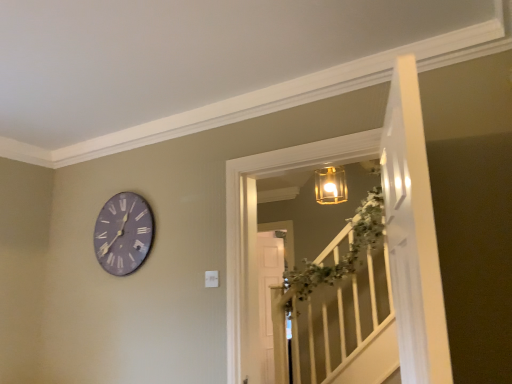
Question: Is translucent glass lantern at upper center taller or shorter than white glossy door at upper right?

Choices:
 (A) short
 (B) tall

Answer: (A)

Question: Is translucent glass lantern at upper center in front of or behind white glossy door at upper right in the image?

Choices:
 (A) front
 (B) behind

Answer: (B)

Question: Estimate the real-world distances between objects in this image. Which object is farther from the translucent glass lantern at upper center?

Choices:
 (A) white glossy door at upper right
 (B) purple matte clock at upper left

Answer: (A)

Question: Which object is positioned closest to the white glossy door at upper right?

Choices:
 (A) purple matte clock at upper left
 (B) translucent glass lantern at upper center

Answer: (A)